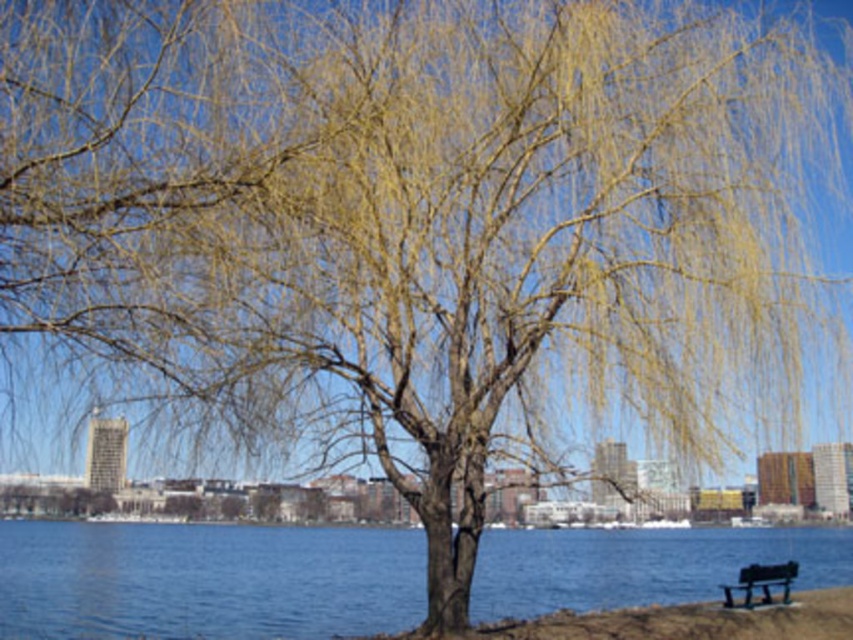
Between blue water at center and green painted wood bench at lower right, which one has more height?

blue water at center is taller.

In the scene shown: Who is higher up, blue water at center or green painted wood bench at lower right?

blue water at center

Locate an element on the screen. The width and height of the screenshot is (853, 640). blue water at center is located at coordinates (206, 580).